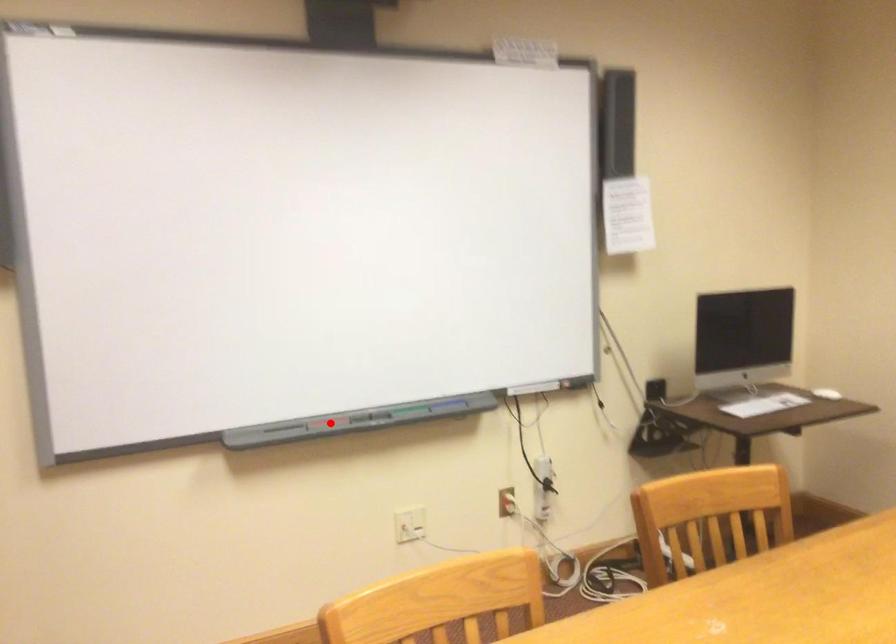
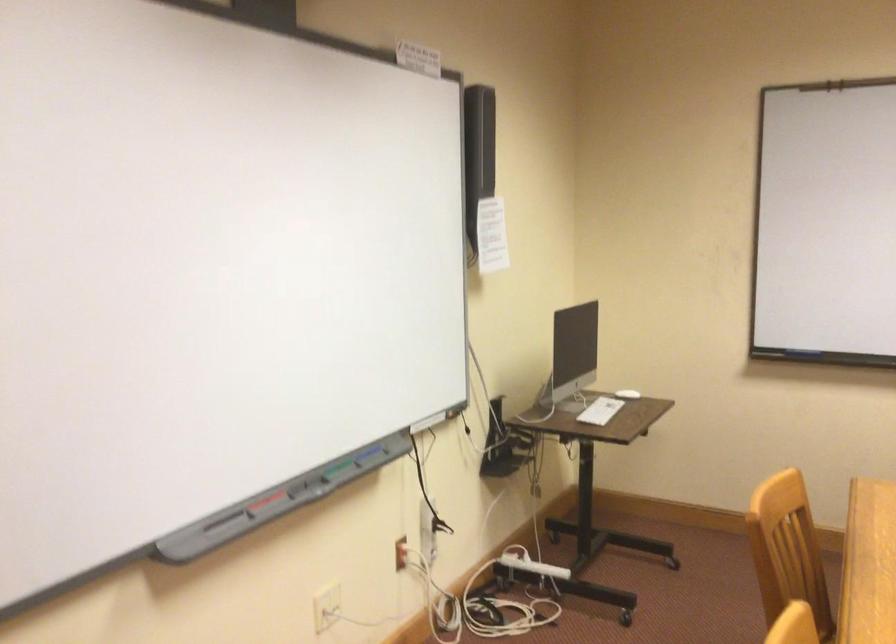
Question: I am providing you with two images of the same scene from different viewpoints. Image1 has a red point marked. In image2, the corresponding 3D location appears at what relative position? Reply with the corresponding letter.

Choices:
 (A) Closer
 (B) Farther

Answer: (A)